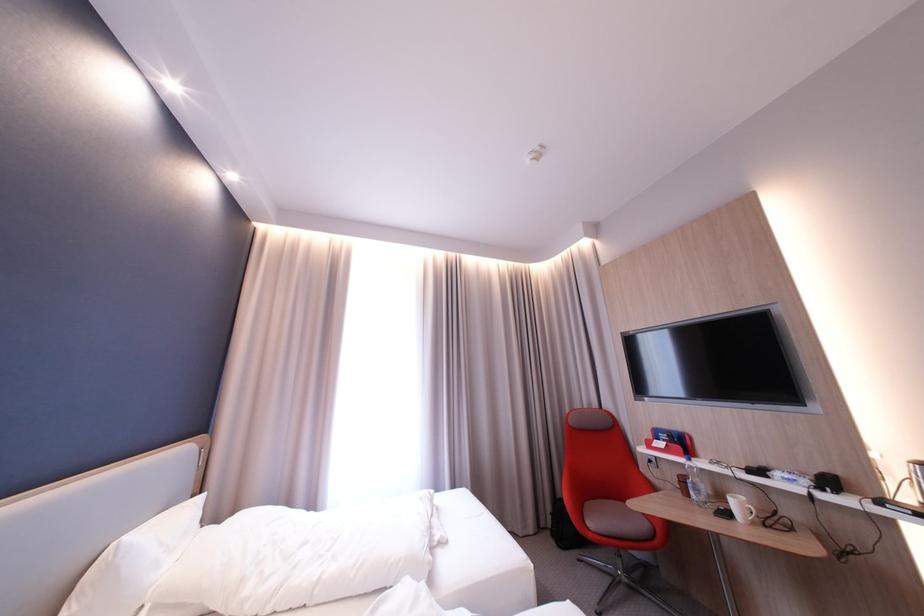
This screenshot has height=616, width=924. What do you see at coordinates (695, 484) in the screenshot?
I see `the plastic water bottle` at bounding box center [695, 484].